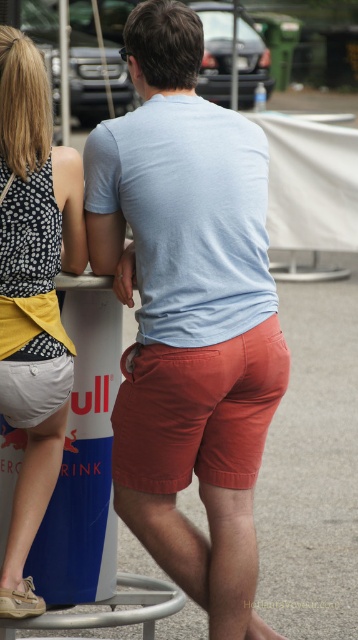
Question: Based on their relative distances, which object is nearer to the metallic pole at upper left?

Choices:
 (A) matte orange shorts at center
 (B) polka dot fabric dress at upper left
 (C) light blue cotton t-shirt at center

Answer: (C)

Question: Does light blue cotton t-shirt at center appear on the right side of metallic pole at upper left?

Choices:
 (A) yes
 (B) no

Answer: (A)

Question: Is polka dot fabric dress at upper left smaller than metallic pole at upper left?

Choices:
 (A) no
 (B) yes

Answer: (B)

Question: Among these points, which one is nearest to the camera?

Choices:
 (A) (205, 358)
 (B) (161, 460)
 (C) (157, 186)

Answer: (A)

Question: Does light blue cotton t-shirt at center appear under matte orange shorts at center?

Choices:
 (A) no
 (B) yes

Answer: (A)

Question: Estimate the real-world distances between objects in this image. Which object is closer to the polka dot fabric dress at upper left?

Choices:
 (A) light blue cotton t-shirt at center
 (B) matte orange shorts at center

Answer: (A)